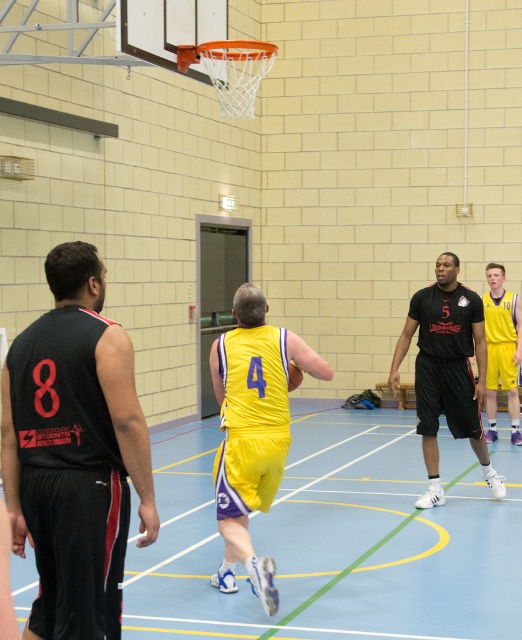
Question: Which point is farther to the camera?

Choices:
 (A) coord(252,561)
 (B) coord(507,316)

Answer: (B)

Question: Is yellow fabric jersey at center below black matte basketball jersey at center?

Choices:
 (A) yes
 (B) no

Answer: (A)

Question: Can you confirm if black matte basketball jersey at center is smaller than yellow jersey at right?

Choices:
 (A) no
 (B) yes

Answer: (A)

Question: Which point is closer to the camera?

Choices:
 (A) yellow fabric jersey at center
 (B) black matte basketball jersey at center

Answer: (A)

Question: Is the position of yellow jersey at center more distant than that of black mesh jersey at left?

Choices:
 (A) yes
 (B) no

Answer: (A)

Question: Which of the following is the farthest from the observer?

Choices:
 (A) (223, 515)
 (B) (276, 522)
 (C) (75, 486)
 (D) (484, 403)

Answer: (D)